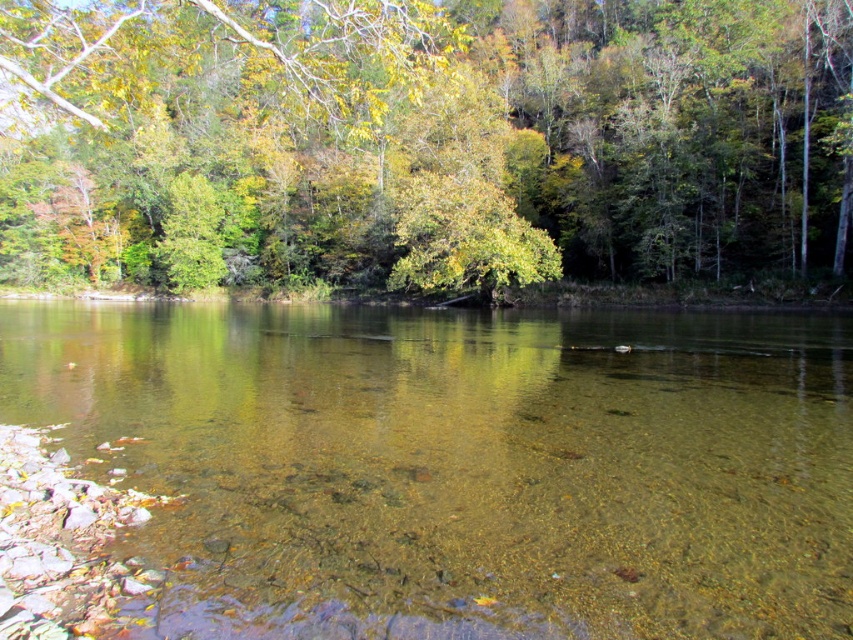
Question: Can you confirm if clear glass water at center is positioned above green leafy tree at upper center?

Choices:
 (A) no
 (B) yes

Answer: (A)

Question: Is clear glass water at center above green leafy tree at upper center?

Choices:
 (A) yes
 (B) no

Answer: (B)

Question: Which object appears farthest from the camera in this image?

Choices:
 (A) clear glass water at center
 (B) green leafy tree at upper center

Answer: (B)

Question: Can you confirm if clear glass water at center is positioned to the left of green leafy tree at upper center?

Choices:
 (A) no
 (B) yes

Answer: (A)

Question: Which point is farther to the camera?

Choices:
 (A) (373, 252)
 (B) (408, 310)

Answer: (A)